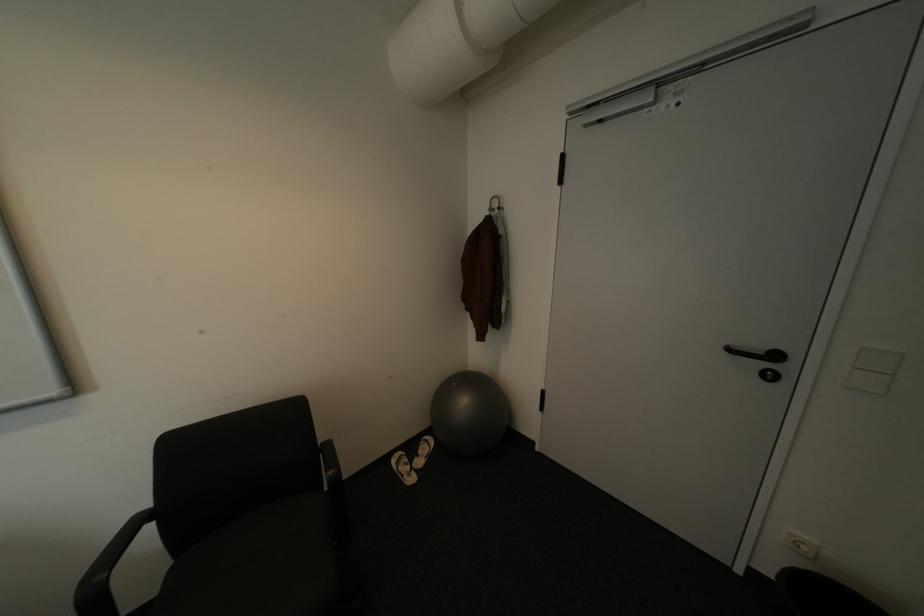
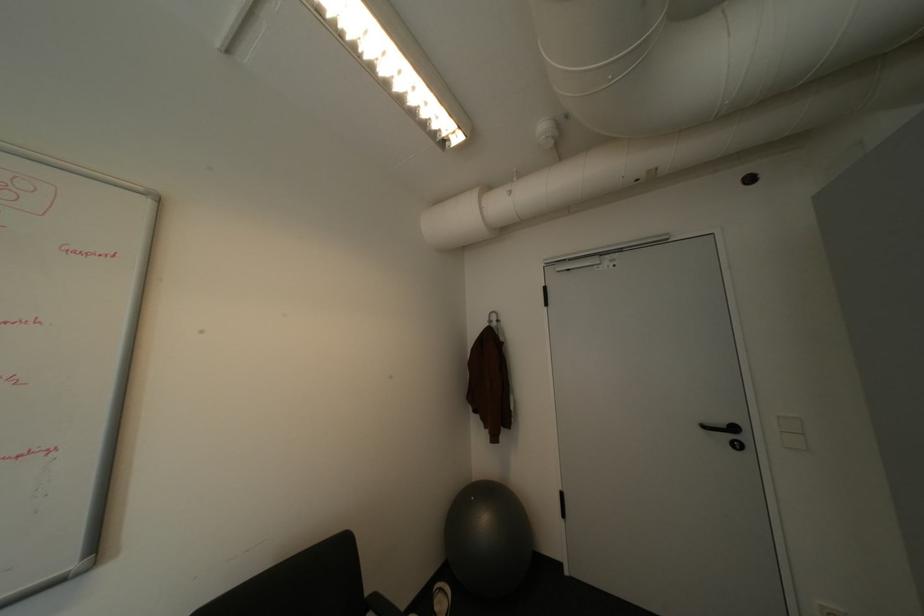
Question: The images are taken continuously from a first-person perspective. In which direction is your viewpoint rotating?

Choices:
 (A) Left
 (B) Right
 (C) Up
 (D) Down

Answer: (C)